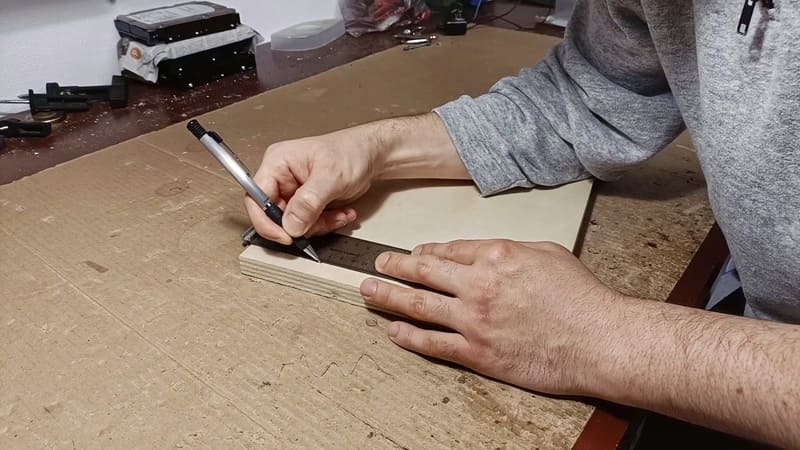
This screenshot has width=800, height=450. I want to click on plywood, so click(x=436, y=203), click(x=310, y=283).